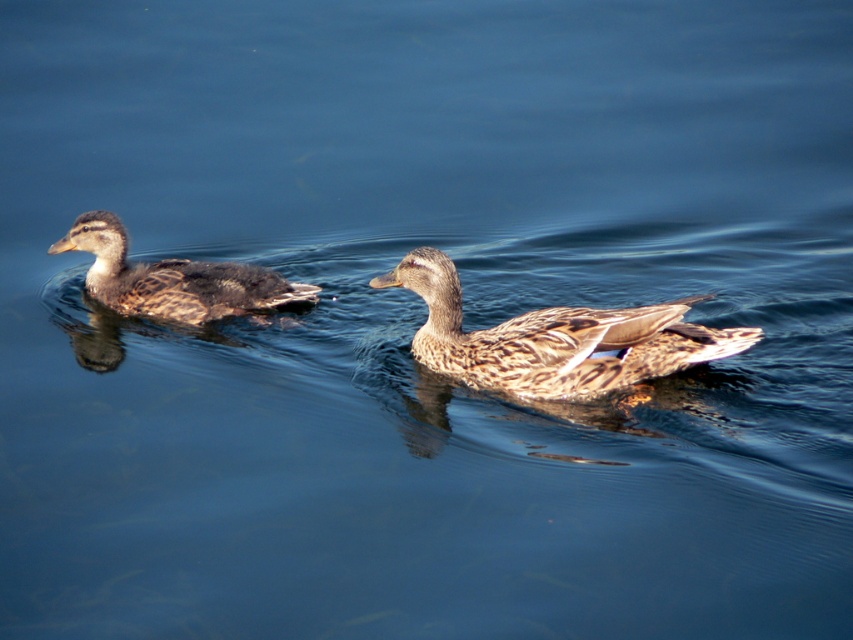
Who is positioned more to the left, brown speckled duck at center or brown speckled duck at left?

brown speckled duck at left is more to the left.

Which of these two, brown speckled duck at center or brown speckled duck at left, stands shorter?

brown speckled duck at left

Who is more distant from viewer, [492,342] or [146,301]?

The point [146,301] is behind.

This screenshot has width=853, height=640. In order to click on brown speckled duck at center in this screenshot , I will do [x=554, y=339].